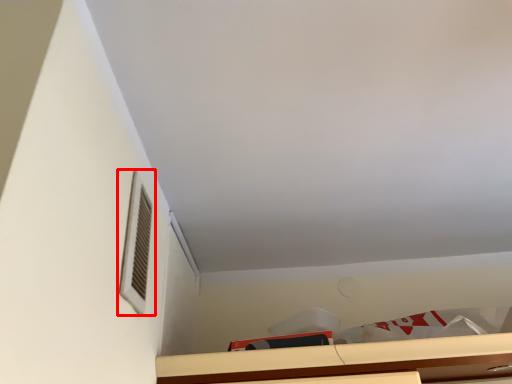
Question: From the image's perspective, what is the correct spatial relationship of window (annotated by the red box) in relation to cabinetry?

Choices:
 (A) below
 (B) above

Answer: (B)